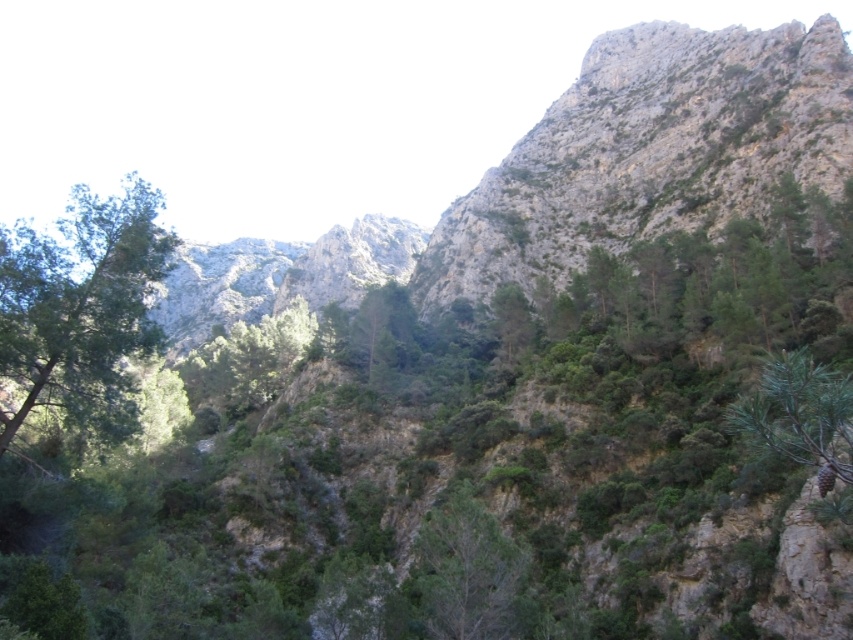
Is point (433, 564) farther from viewer compared to point (746, 396)?

No, it is not.

Can you confirm if green leafy tree at center is positioned below green matte pine cone at right?

Yes, green leafy tree at center is below green matte pine cone at right.

This screenshot has width=853, height=640. Identify the location of green leafy tree at center. tap(465, 572).

Can you confirm if green leafy tree at left is thinner than green matte pine cone at right?

In fact, green leafy tree at left might be wider than green matte pine cone at right.

Who is shorter, green leafy tree at left or green matte pine cone at right?

Standing shorter between the two is green matte pine cone at right.

At what (x,y) coordinates should I click in order to perform the action: click on green leafy tree at left. Please return your answer as a coordinate pair (x, y). This screenshot has height=640, width=853. Looking at the image, I should click on (80, 310).

This screenshot has width=853, height=640. Identify the location of green leafy tree at left. (80, 310).

Is rugged stone mountain at upper right further to the viewer compared to green matte pine cone at right?

Yes, it is.

Between rugged stone mountain at upper right and green matte pine cone at right, which one appears on the left side from the viewer's perspective?

From the viewer's perspective, green matte pine cone at right appears more on the left side.

Is point (749, 113) positioned before point (753, 444)?

No, (749, 113) is behind (753, 444).

The height and width of the screenshot is (640, 853). I want to click on rugged stone mountain at upper right, so click(648, 150).